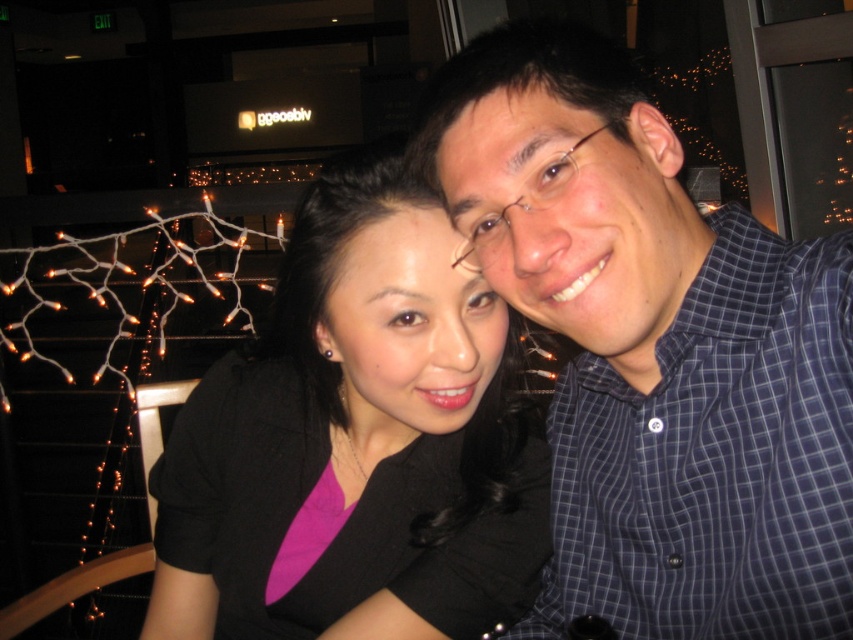
You are standing at the center of the room and want to walk towards the two points in the image. Which point should you walk towards first if you want to reach the one that is closer to you? Please choose between point A and point B, where point A is point (x=606, y=419) and point B is point (x=389, y=406).

You should walk towards point B first because point B is closer to you than point A, which is further away.

You are a photographer setting up for a group photo. You need to ensure that the blue checkered shirt at center and the black matte shirt at center are visible in the frame. Considering their widths, which shirt might require more space to accommodate its width in the photo?

The black matte shirt at center requires more space because its width is greater than the blue checkered shirt at center.